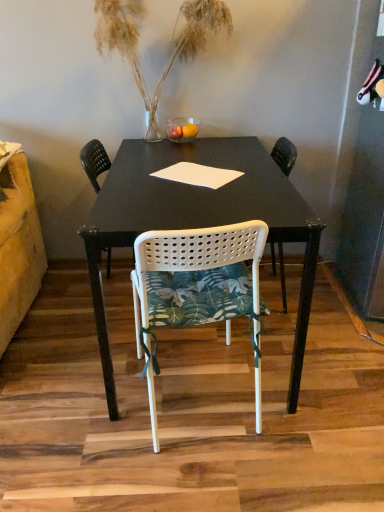
Question: Does translucent glass vase at upper center have a lesser width compared to white perforated plastic chair at center, which is counted as the second chair, starting from the back?

Choices:
 (A) yes
 (B) no

Answer: (A)

Question: From a real-world perspective, is translucent glass vase at upper center located higher than white perforated plastic chair at center, which is counted as the second chair, starting from the back?

Choices:
 (A) yes
 (B) no

Answer: (A)

Question: From the image's perspective, is translucent glass vase at upper center above white perforated plastic chair at center, positioned as the 1th chair in front-to-back order?

Choices:
 (A) yes
 (B) no

Answer: (A)

Question: Is translucent glass vase at upper center surrounding white perforated plastic chair at center, which is counted as the second chair, starting from the back?

Choices:
 (A) yes
 (B) no

Answer: (B)

Question: Is translucent glass vase at upper center turned away from white perforated plastic chair at center, positioned as the 1th chair in front-to-back order?

Choices:
 (A) yes
 (B) no

Answer: (B)

Question: Does translucent glass vase at upper center have a larger size compared to white perforated plastic chair at center, positioned as the 1th chair in front-to-back order?

Choices:
 (A) no
 (B) yes

Answer: (A)

Question: Is white perforated plastic chair at center, the second chair viewed from the front, not near white perforated plastic chair at center, which is counted as the second chair, starting from the back?

Choices:
 (A) yes
 (B) no

Answer: (A)

Question: From a real-world perspective, is white perforated plastic chair at center, the second chair viewed from the front, located beneath white perforated plastic chair at center, positioned as the 1th chair in front-to-back order?

Choices:
 (A) yes
 (B) no

Answer: (A)

Question: Is white perforated plastic chair at center, the second chair viewed from the front, at the left side of white perforated plastic chair at center, positioned as the 1th chair in front-to-back order?

Choices:
 (A) no
 (B) yes

Answer: (B)

Question: From a real-world perspective, is white perforated plastic chair at center, the second chair viewed from the front, on top of white perforated plastic chair at center, positioned as the 1th chair in front-to-back order?

Choices:
 (A) yes
 (B) no

Answer: (B)

Question: Does white perforated plastic chair at center, arranged as the 1th chair when viewed from the back, turn towards white perforated plastic chair at center, which is counted as the second chair, starting from the back?

Choices:
 (A) no
 (B) yes

Answer: (A)

Question: From the image's perspective, is white perforated plastic chair at center, arranged as the 1th chair when viewed from the back, on top of white perforated plastic chair at center, positioned as the 1th chair in front-to-back order?

Choices:
 (A) yes
 (B) no

Answer: (A)

Question: Is translucent glass vase at upper center in front of white perforated plastic chair at center, the second chair viewed from the front?

Choices:
 (A) yes
 (B) no

Answer: (A)